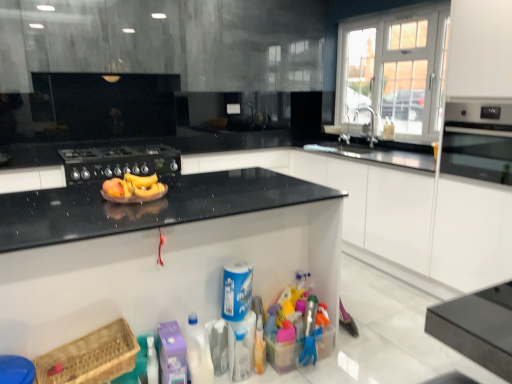
At what (x,y) coordinates should I click in order to perform the action: click on free space above purple plastic container at lower center, which is the fourth cleaning product from right to left (from a real-world perspective). Please return your answer as a coordinate pair (x, y). Image resolution: width=512 pixels, height=384 pixels. Looking at the image, I should click on (173, 336).